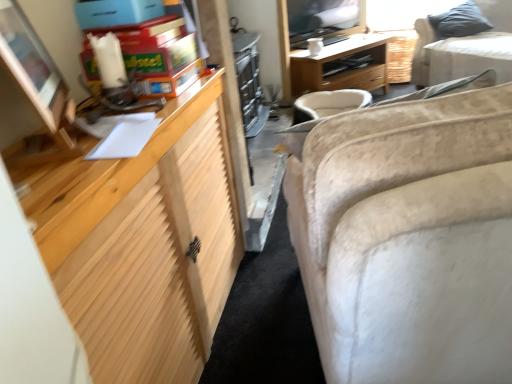
What do you see at coordinates (341, 71) in the screenshot? I see `wooden desk at center` at bounding box center [341, 71].

Identify the location of beige fabric couch at upper right, marked as the 2th studio couch in a bottom-to-top arrangement. This screenshot has height=384, width=512. (465, 49).

The image size is (512, 384). What do you see at coordinates (459, 21) in the screenshot?
I see `gray fabric pillow at upper right` at bounding box center [459, 21].

Locate an element on the screen. This screenshot has height=384, width=512. matte wooden monitor at left is located at coordinates (31, 65).

From the image's perspective, is matte wooden monitor at left on wooden desk at center?

No, from the image's perspective, matte wooden monitor at left is not on top of wooden desk at center.

Which of these two, matte wooden monitor at left or wooden desk at center, is bigger?

wooden desk at center.

Looking at this image, between matte wooden monitor at left and wooden desk at center, which one has more height?

wooden desk at center is taller.

Which is correct: matte wooden monitor at left is inside wooden desk at center, or outside of it?

matte wooden monitor at left lies outside wooden desk at center.

Is matte wooden monitor at left thinner than gray fabric pillow at upper right?

Yes.

From a real-world perspective, between matte wooden monitor at left and gray fabric pillow at upper right, who is vertically higher?

From a 3D spatial view, matte wooden monitor at left is above.

Considering the sizes of objects matte wooden monitor at left and gray fabric pillow at upper right in the image provided, who is shorter, matte wooden monitor at left or gray fabric pillow at upper right?

Standing shorter between the two is matte wooden monitor at left.

Are matte wooden monitor at left and beige fabric couch at right, the first studio couch positioned from the front, located far from each other?

No, matte wooden monitor at left is not far from beige fabric couch at right, the first studio couch positioned from the front.

What's the angular difference between matte wooden monitor at left and beige fabric couch at right, which ranks as the second studio couch in top-to-bottom order,'s facing directions?

27.9 degrees separate the facing orientations of matte wooden monitor at left and beige fabric couch at right, which ranks as the second studio couch in top-to-bottom order.

From the image's perspective, relative to beige fabric couch at right, which ranks as the second studio couch in top-to-bottom order, is matte wooden monitor at left above or below?

From the image's perspective, matte wooden monitor at left appears above beige fabric couch at right, which ranks as the second studio couch in top-to-bottom order.

From the picture: Could you tell me if matte wooden monitor at left is turned towards beige fabric couch at right, positioned as the 1th studio couch in left-to-right order?

Yes, matte wooden monitor at left is aimed at beige fabric couch at right, positioned as the 1th studio couch in left-to-right order.

Is point (350, 40) farther from camera compared to point (18, 69)?

That is True.

From a real-world perspective, is wooden desk at center under matte wooden monitor at left?

Yes, from a real-world perspective, wooden desk at center is beneath matte wooden monitor at left.

Based on the photo, does wooden desk at center have a greater height compared to matte wooden monitor at left?

Indeed, wooden desk at center has a greater height compared to matte wooden monitor at left.

Measure the distance between wooden desk at center and matte wooden monitor at left.

The distance of wooden desk at center from matte wooden monitor at left is 8.72 feet.

Which point is more distant from viewer, (464, 33) or (163, 79)?

The point (464, 33) is farther from the camera.

Does gray fabric pillow at upper right turn towards matte cardboard toy at upper left?

No, gray fabric pillow at upper right is not facing towards matte cardboard toy at upper left.

Measure the distance between gray fabric pillow at upper right and matte cardboard toy at upper left.

gray fabric pillow at upper right is 9.39 feet from matte cardboard toy at upper left.

Considering the relative sizes of gray fabric pillow at upper right and matte cardboard toy at upper left in the image provided, is gray fabric pillow at upper right smaller than matte cardboard toy at upper left?

No.

Is the depth of matte wooden monitor at left greater than that of beige fabric swivel chair at center?

No, matte wooden monitor at left is closer to the viewer.

In the scene shown: Between matte wooden monitor at left and beige fabric swivel chair at center, which one appears on the left side from the viewer's perspective?

matte wooden monitor at left.

Does matte wooden monitor at left have a larger size compared to beige fabric swivel chair at center?

Incorrect, matte wooden monitor at left is not larger than beige fabric swivel chair at center.

From the image's perspective, is matte wooden monitor at left above beige fabric swivel chair at center?

No.

Is gray fabric pillow at upper right smaller than wooden desk at center?

Indeed, gray fabric pillow at upper right has a smaller size compared to wooden desk at center.

From the image's perspective, between gray fabric pillow at upper right and wooden desk at center, which one is located above?

gray fabric pillow at upper right.

From a real-world perspective, is gray fabric pillow at upper right physically located above or below wooden desk at center?

From a real-world perspective, gray fabric pillow at upper right is physically above wooden desk at center.

Is gray fabric pillow at upper right touching wooden desk at center?

No, gray fabric pillow at upper right is not with wooden desk at center.

Find the location of a particular element. The image size is (512, 384). computer monitor positioned vertically above the wooden desk at center (from a real-world perspective) is located at coordinates (31, 65).

Identify the location of computer monitor on the left of gray fabric pillow at upper right. Image resolution: width=512 pixels, height=384 pixels. (31, 65).

Considering their positions, is matte cardboard toy at upper left positioned closer to wooden desk at center than beige fabric swivel chair at center?

The object closer to wooden desk at center is beige fabric swivel chair at center.

When comparing their distances from beige fabric couch at upper right, which is the second studio couch in left-to-right order, does beige fabric swivel chair at center or matte wooden monitor at left seem closer?

Among the two, beige fabric swivel chair at center is located nearer to beige fabric couch at upper right, which is the second studio couch in left-to-right order.

Based on their spatial positions, is beige fabric swivel chair at center or matte cardboard toy at upper left further from beige fabric couch at right, the first studio couch positioned from the front?

beige fabric swivel chair at center is positioned further to the anchor beige fabric couch at right, the first studio couch positioned from the front.

Based on their spatial positions, is beige fabric couch at upper right, which is the first studio couch from right to left, or matte wooden monitor at left closer to gray fabric pillow at upper right?

beige fabric couch at upper right, which is the first studio couch from right to left, is closer to gray fabric pillow at upper right.

When comparing their distances from wooden desk at center, does matte wooden monitor at left or beige fabric couch at right, which ranks as the second studio couch in top-to-bottom order, seem further?

The object further to wooden desk at center is beige fabric couch at right, which ranks as the second studio couch in top-to-bottom order.

When comparing their distances from matte cardboard toy at upper left, does beige fabric couch at upper right, the first studio couch in the top-to-bottom sequence, or beige fabric couch at right, positioned as the 1th studio couch in left-to-right order, seem further?

beige fabric couch at upper right, the first studio couch in the top-to-bottom sequence, is positioned further to the anchor matte cardboard toy at upper left.

Looking at the image, which one is located closer to matte wooden monitor at left, gray fabric pillow at upper right or beige fabric couch at right, the 2th studio couch from the right?

beige fabric couch at right, the 2th studio couch from the right, lies closer to matte wooden monitor at left than the other object.

Based on their spatial positions, is wooden desk at center or beige fabric swivel chair at center further from beige fabric couch at right, which ranks as the second studio couch in top-to-bottom order?

wooden desk at center lies further to beige fabric couch at right, which ranks as the second studio couch in top-to-bottom order, than the other object.

Image resolution: width=512 pixels, height=384 pixels. What are the coordinates of `toy between beige fabric couch at right, the first studio couch positioned from the front, and beige fabric swivel chair at center, along the z-axis` in the screenshot? It's located at tap(159, 54).

Locate an element on the screen. The height and width of the screenshot is (384, 512). toy positioned between matte wooden monitor at left and beige fabric swivel chair at center from near to far is located at coordinates [159, 54].

This screenshot has height=384, width=512. What are the coordinates of `swivel chair positioned between matte cardboard toy at upper left and beige fabric couch at upper right, which is the second studio couch in left-to-right order, from near to far` in the screenshot? It's located at (329, 103).

I want to click on studio couch located between matte wooden monitor at left and beige fabric couch at upper right, which is the first studio couch from right to left, in the depth direction, so click(x=409, y=239).